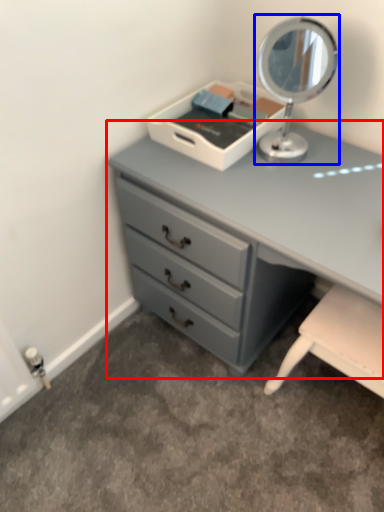
Question: Which point is further to the camera, chest of drawers (highlighted by a red box) or table lamp (highlighted by a blue box)?

Choices:
 (A) chest of drawers
 (B) table lamp

Answer: (B)